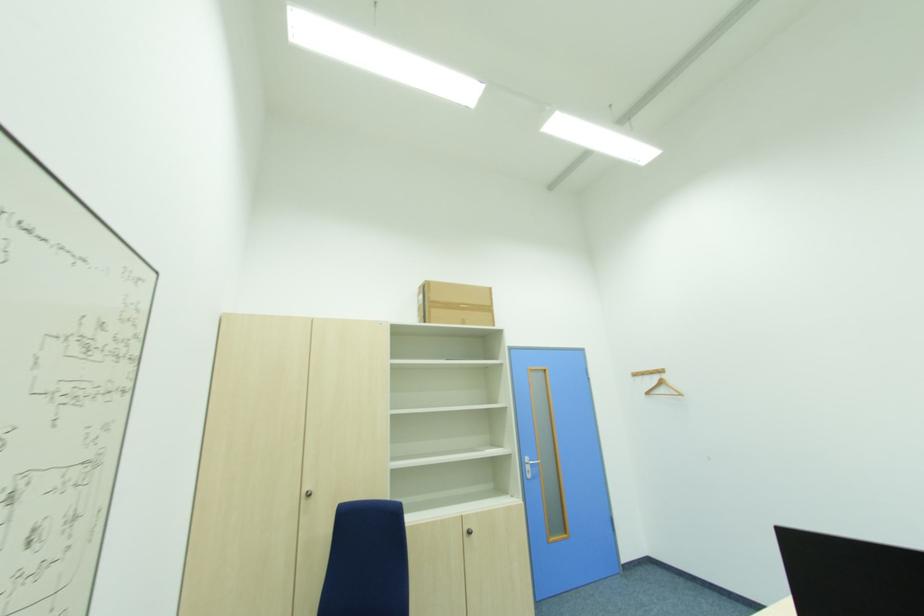
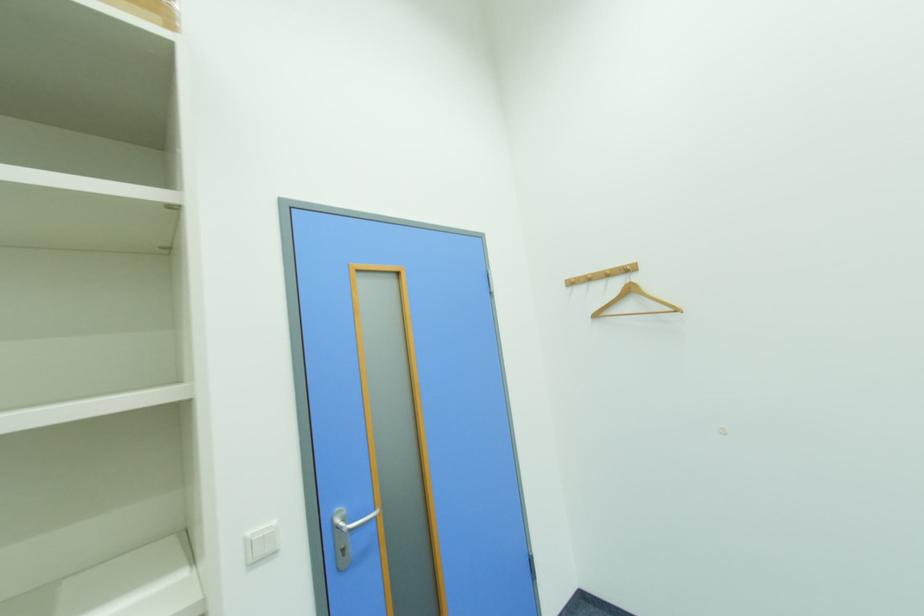
Where in the second image is the point corresponding to [651,394] from the first image?

(601, 317)